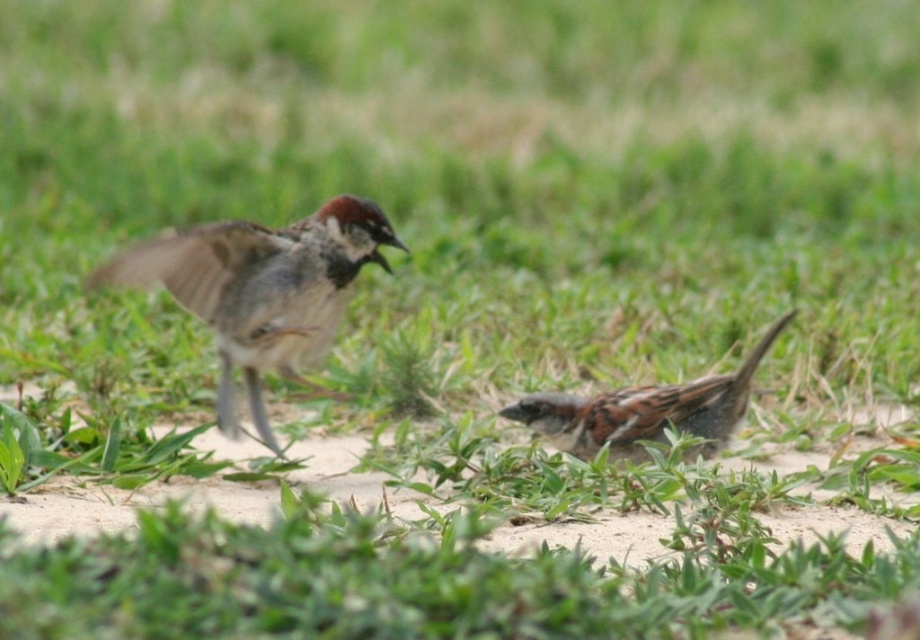
You are a birdwatcher observing two birds in a grassy area. You notice a bird in mid action at the left and another bird lying on the ground at the right. Which bird is closer to the point marked at coordinates (260, 289)?

The point marked at coordinates (260, 289) indicates the brown feathered sparrow at left, so the bird in mid action at the left is closer to the point.

You are a birdwatcher observing the two sparrows in the image. Which of the two sparrows, the brown feathered sparrow at left or the brown speckled sparrow at lower right, has a greater body size?

The brown feathered sparrow at left is larger in size than the brown speckled sparrow at lower right.